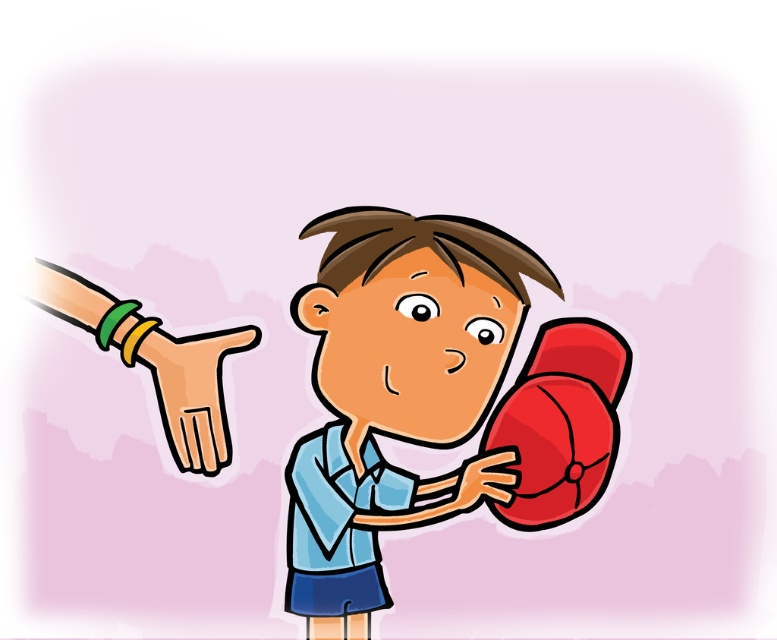
You are a character in the image and you need to reach the shiny red boxing glove at right and the rubber glove at lower right. Which one is closer to you?

The shiny red boxing glove at right is closer to you because it is in front of the rubber glove at lower right.

You are a child in the image holding a red ball. You notice a red matte boxing glove at left and a smooth beige hand at left. Which object is positioned higher in the image?

The red matte boxing glove at left is above the smooth beige hand at left, so the red matte boxing glove at left is positioned higher.

You are the boy holding the red ball in the image. You notice two hands near you. Which hand is closer to you, the smooth beige hand at left or the rubber glove at lower right?

The smooth beige hand at left is closer to you because it is positioned over the rubber glove at lower right, indicating it is in front.